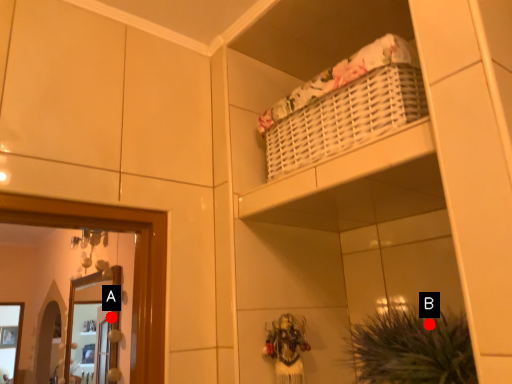
Question: Two points are circled on the image, labeled by A and B beside each circle. Which point is farther from the camera taking this photo?

Choices:
 (A) A is further
 (B) B is further

Answer: (A)